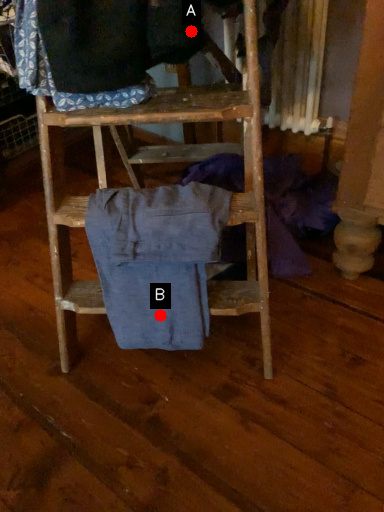
Question: Two points are circled on the image, labeled by A and B beside each circle. Which point appears farthest from the camera in this image?

Choices:
 (A) A is further
 (B) B is further

Answer: (B)